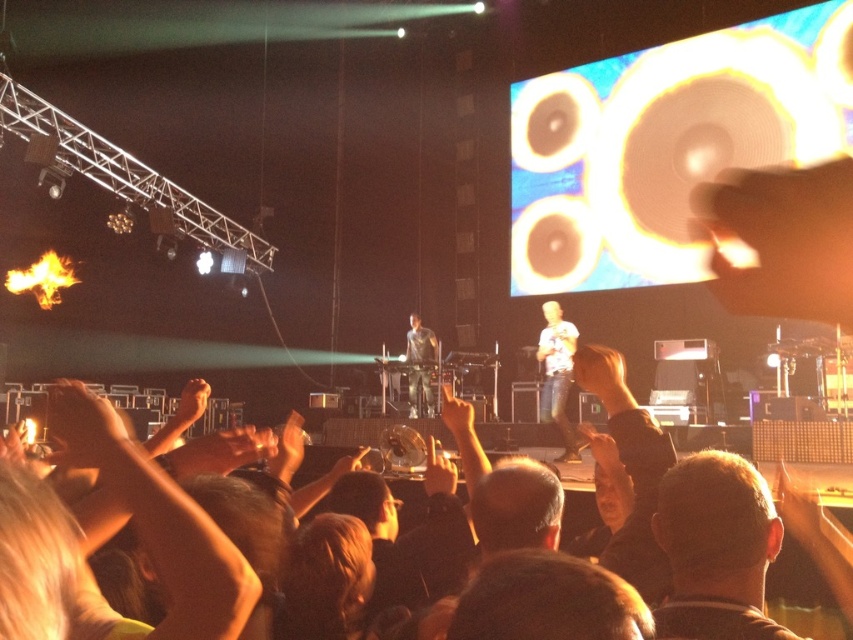
Is point (570, 461) farther from viewer compared to point (410, 316)?

No, it is in front of (410, 316).

Which of these two, white cotton shirt at center or dark gray shirt at center, stands shorter?

dark gray shirt at center is shorter.

Does point (544, 380) lie behind point (421, 358)?

No, (544, 380) is closer to viewer.

You are a GUI agent. You are given a task and a screenshot of the screen. Output one action in this format:
    pyautogui.click(x=<x>, y=<y>)
    Task: Click on the white cotton shirt at center
    This screenshot has height=640, width=853.
    Given the screenshot: What is the action you would take?
    pyautogui.click(x=556, y=374)